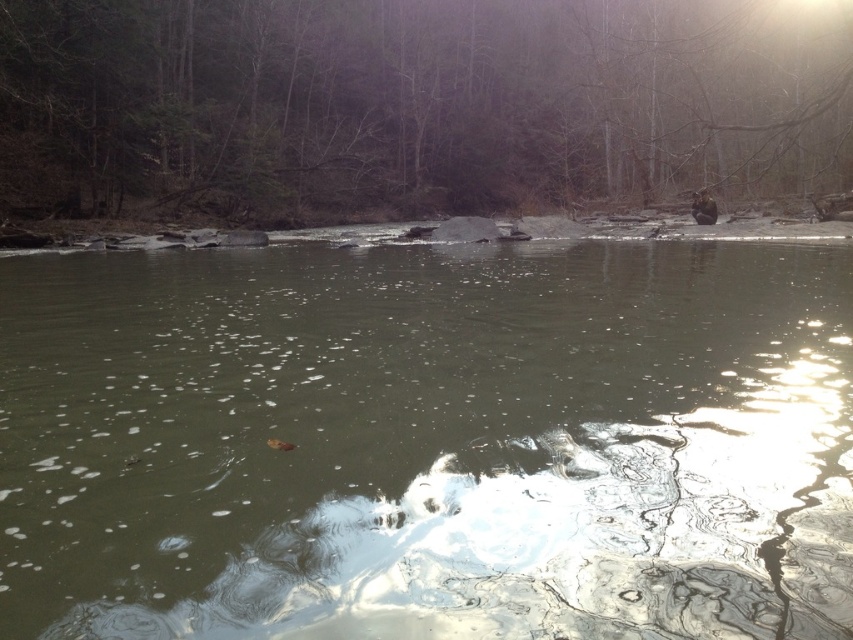
Which is more to the left, greenish murky water at center or brown wood tree at center?

greenish murky water at center

Which is in front, point (741, 419) or point (120, 208)?

Point (741, 419) is more forward.

This screenshot has width=853, height=640. What do you see at coordinates (427, 442) in the screenshot?
I see `greenish murky water at center` at bounding box center [427, 442].

You are a GUI agent. You are given a task and a screenshot of the screen. Output one action in this format:
    pyautogui.click(x=<x>, y=<y>)
    Task: Click on the greenish murky water at center
    The image size is (853, 640).
    Given the screenshot: What is the action you would take?
    pyautogui.click(x=427, y=442)